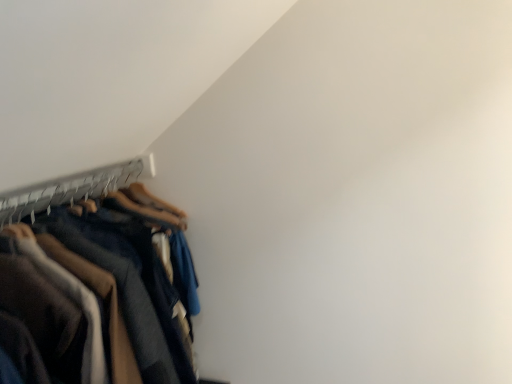
Question: From the image's perspective, is dark blue cotton trousers at left on top of wooden hanger at left?

Choices:
 (A) no
 (B) yes

Answer: (A)

Question: Considering the relative sizes of dark blue cotton trousers at left and wooden hanger at left in the image provided, is dark blue cotton trousers at left shorter than wooden hanger at left?

Choices:
 (A) yes
 (B) no

Answer: (B)

Question: Does dark blue cotton trousers at left have a smaller size compared to wooden hanger at left?

Choices:
 (A) no
 (B) yes

Answer: (A)

Question: Would you say dark blue cotton trousers at left is outside wooden hanger at left?

Choices:
 (A) no
 (B) yes

Answer: (B)

Question: Does dark blue cotton trousers at left have a lesser width compared to wooden hanger at left?

Choices:
 (A) yes
 (B) no

Answer: (B)

Question: From a real-world perspective, is dark blue cotton trousers at left under wooden hanger at left?

Choices:
 (A) no
 (B) yes

Answer: (B)

Question: Is wooden hanger at left oriented towards dark blue cotton trousers at left?

Choices:
 (A) no
 (B) yes

Answer: (B)

Question: Considering the relative sizes of wooden hanger at left and dark blue cotton trousers at left in the image provided, is wooden hanger at left smaller than dark blue cotton trousers at left?

Choices:
 (A) no
 (B) yes

Answer: (B)

Question: Is wooden hanger at left far away from dark blue cotton trousers at left?

Choices:
 (A) yes
 (B) no

Answer: (B)

Question: Considering the relative positions of wooden hanger at left and dark blue cotton trousers at left in the image provided, is wooden hanger at left to the left of dark blue cotton trousers at left from the viewer's perspective?

Choices:
 (A) no
 (B) yes

Answer: (B)

Question: Is wooden hanger at left oriented away from dark blue cotton trousers at left?

Choices:
 (A) yes
 (B) no

Answer: (A)

Question: Is wooden hanger at left outside of dark blue cotton trousers at left?

Choices:
 (A) no
 (B) yes

Answer: (A)

Question: In terms of height, does dark blue cotton trousers at left look taller or shorter compared to wooden hanger at left?

Choices:
 (A) short
 (B) tall

Answer: (B)